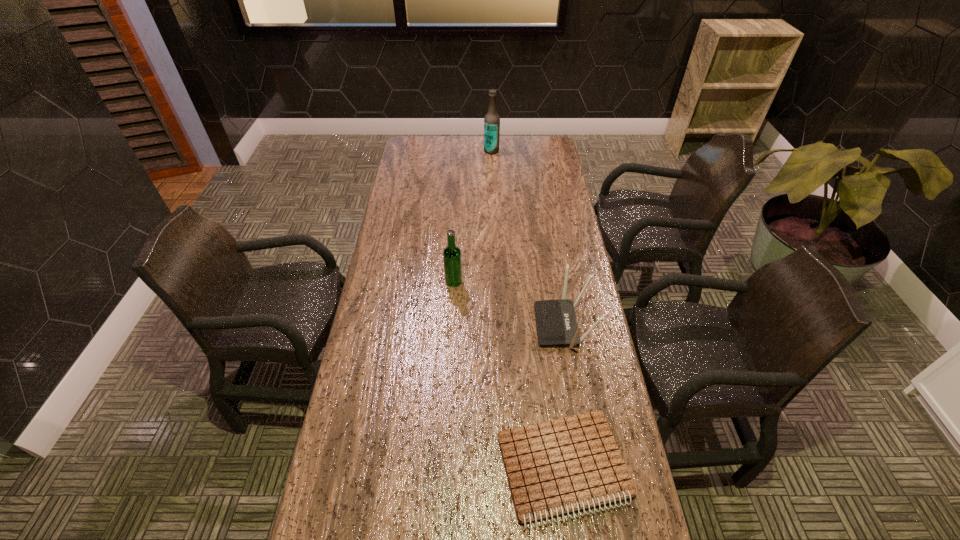
Identify which object is located as the nearest to the second farthest object. Please provide its 2D coordinates. Your answer should be formatted as a tuple, i.e. [(x, y)], where the tuple contains the x and y coordinates of a point satisfying the conditions above.

[(556, 322)]

Identify which object is the second closest to the farther beer bottle. Please provide its 2D coordinates. Your answer should be formatted as a tuple, i.e. [(x, y)], where the tuple contains the x and y coordinates of a point satisfying the conditions above.

[(556, 322)]

The image size is (960, 540). Find the location of `vacant region that satisfies the following two spatial constraints: 1. on the side of the notebook with the label; 2. on the left side of the tallest object`. vacant region that satisfies the following two spatial constraints: 1. on the side of the notebook with the label; 2. on the left side of the tallest object is located at coordinates (502, 468).